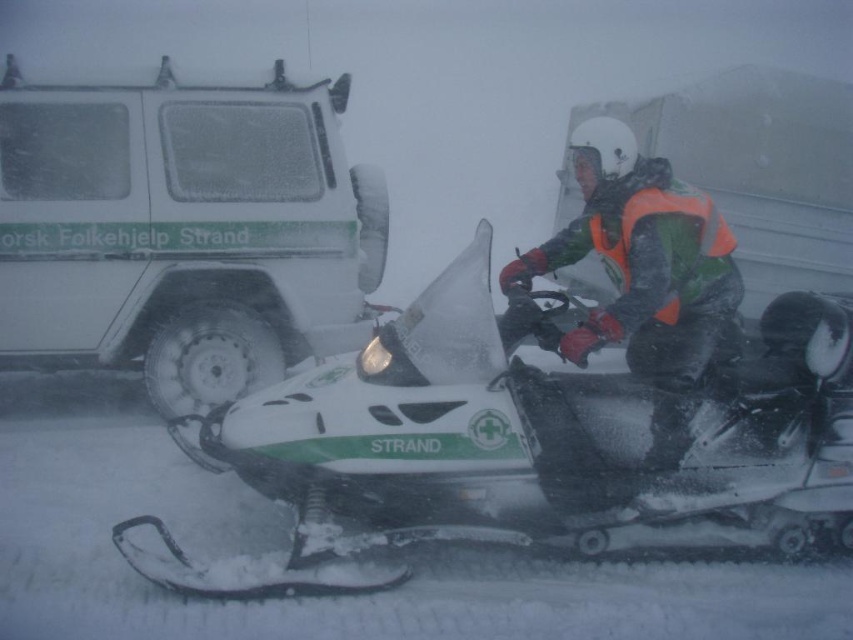
Does point (169, 369) come farther from viewer compared to point (651, 380)?

Yes, it is.

Who is positioned more to the right, white matte van at upper left or reflective orange vest at center?

From the viewer's perspective, reflective orange vest at center appears more on the right side.

Which is in front, point (115, 356) or point (656, 212)?

Point (656, 212) is more forward.

The image size is (853, 640). Find the location of `white matte van at upper left`. white matte van at upper left is located at coordinates (183, 230).

Who is higher up, white matte snowmobile at center or reflective orange vest at center?

reflective orange vest at center

Does point (544, 497) come farther from viewer compared to point (573, 248)?

That is False.

Is point (846, 349) closer to viewer compared to point (634, 280)?

No, (846, 349) is behind (634, 280).

This screenshot has height=640, width=853. What are the coordinates of `white matte snowmobile at center` in the screenshot? It's located at (518, 451).

Is white matte snowmobile at center thinner than white matte van at upper left?

Incorrect, white matte snowmobile at center's width is not less than white matte van at upper left's.

Locate an element on the screen. Image resolution: width=853 pixels, height=640 pixels. white matte snowmobile at center is located at coordinates (518, 451).

At what (x,y) coordinates should I click in order to perform the action: click on white matte snowmobile at center. Please return your answer as a coordinate pair (x, y). This screenshot has height=640, width=853. Looking at the image, I should click on (518, 451).